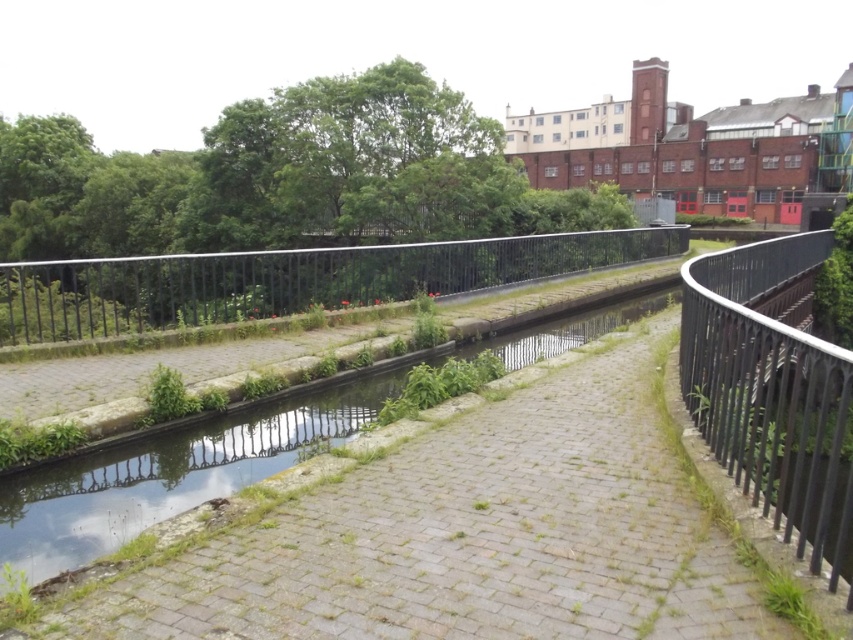
Question: Estimate the real-world distances between objects in this image. Which object is farther from the brick paved path at center?

Choices:
 (A) black metal fence at center
 (B) black metal fence at right

Answer: (A)

Question: Is brick paved path at center smaller than black metal fence at right?

Choices:
 (A) no
 (B) yes

Answer: (B)

Question: Which of these objects is positioned closest to the brick paved path at center?

Choices:
 (A) black metal fence at center
 (B) black metal fence at right

Answer: (B)

Question: Is brick paved path at center in front of black metal fence at center?

Choices:
 (A) no
 (B) yes

Answer: (B)

Question: Can you confirm if brick paved path at center is bigger than black metal fence at right?

Choices:
 (A) yes
 (B) no

Answer: (B)

Question: Among these points, which one is farthest from the camera?

Choices:
 (A) coord(294,480)
 (B) coord(793,355)

Answer: (A)